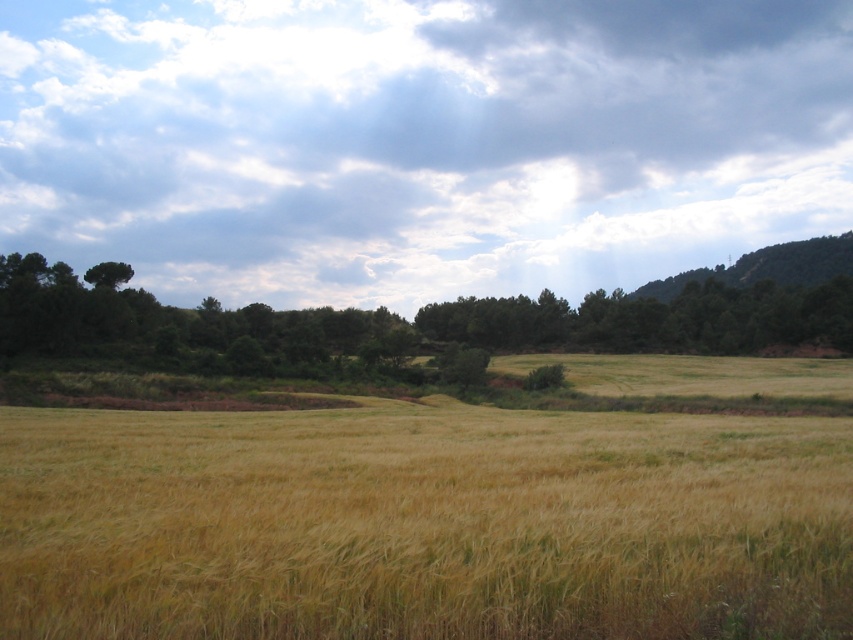
Which is below, cloudy sky at upper center or green leafy tree at upper left?

green leafy tree at upper left

You are a GUI agent. You are given a task and a screenshot of the screen. Output one action in this format:
    pyautogui.click(x=<x>, y=<y>)
    Task: Click on the cloudy sky at upper center
    
    Given the screenshot: What is the action you would take?
    (x=418, y=141)

Measure the distance between golden grassy field at center and green leafy tree at upper left.

They are 78.51 meters apart.

Which of these two, golden grassy field at center or green leafy tree at upper left, stands shorter?

golden grassy field at center

Is point (180, 474) less distant than point (93, 284)?

Yes, it is in front of point (93, 284).

This screenshot has width=853, height=640. Identify the location of golden grassy field at center. (422, 524).

Does cloudy sky at upper center appear under golden grassy field at center?

Incorrect, cloudy sky at upper center is not positioned below golden grassy field at center.

Which is more to the left, cloudy sky at upper center or golden grassy field at center?

golden grassy field at center is more to the left.

Between point (190, 134) and point (305, 483), which one is positioned behind?

Point (190, 134)

Identify the location of cloudy sky at upper center. The image size is (853, 640). (418, 141).